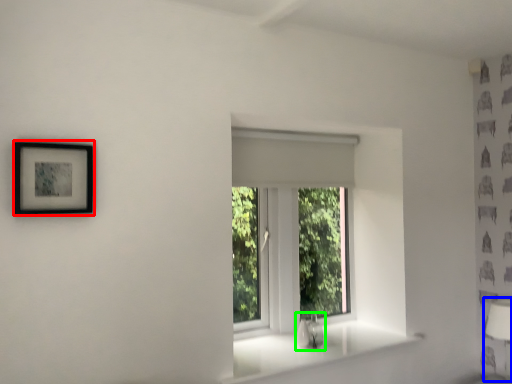
Question: Estimate the real-world distances between objects in this image. Which object is closer to picture frame (highlighted by a red box), table lamp (highlighted by a blue box) or sink (highlighted by a green box)?

Choices:
 (A) table lamp
 (B) sink

Answer: (B)